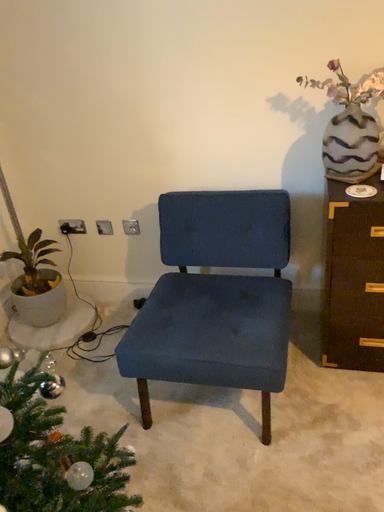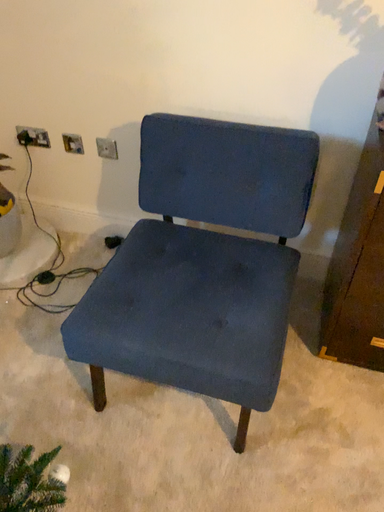
Question: How did the camera likely rotate when shooting the video?

Choices:
 (A) rotated downward
 (B) rotated upward

Answer: (A)